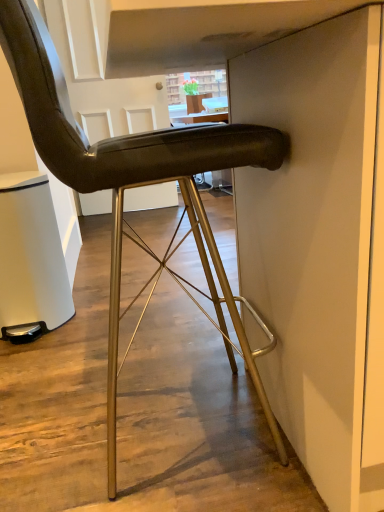
Question: Is white matte trash can at lower left taller than matte black chair at center?

Choices:
 (A) no
 (B) yes

Answer: (A)

Question: From the image's perspective, is white matte trash can at lower left located above matte black chair at center?

Choices:
 (A) yes
 (B) no

Answer: (B)

Question: Does white matte trash can at lower left have a smaller size compared to matte black chair at center?

Choices:
 (A) no
 (B) yes

Answer: (B)

Question: Is white matte trash can at lower left far from matte black chair at center?

Choices:
 (A) yes
 (B) no

Answer: (B)

Question: Is white matte trash can at lower left shorter than matte black chair at center?

Choices:
 (A) no
 (B) yes

Answer: (B)

Question: Is white matte trash can at lower left touching matte black chair at center?

Choices:
 (A) no
 (B) yes

Answer: (A)

Question: Does matte black chair at center appear on the right side of white matte trash can at lower left?

Choices:
 (A) yes
 (B) no

Answer: (A)

Question: Considering the relative positions of matte black chair at center and white matte trash can at lower left in the image provided, is matte black chair at center to the left of white matte trash can at lower left from the viewer's perspective?

Choices:
 (A) yes
 (B) no

Answer: (B)

Question: From the image's perspective, is matte black chair at center below white matte trash can at lower left?

Choices:
 (A) no
 (B) yes

Answer: (A)

Question: Is matte black chair at center touching white matte trash can at lower left?

Choices:
 (A) no
 (B) yes

Answer: (A)

Question: Is matte black chair at center closer to the viewer compared to white matte trash can at lower left?

Choices:
 (A) no
 (B) yes

Answer: (B)

Question: Considering the relative sizes of matte black chair at center and white matte trash can at lower left in the image provided, is matte black chair at center taller than white matte trash can at lower left?

Choices:
 (A) yes
 (B) no

Answer: (A)

Question: Would you say matte black chair at center is to the left or to the right of white matte trash can at lower left in the picture?

Choices:
 (A) left
 (B) right

Answer: (B)